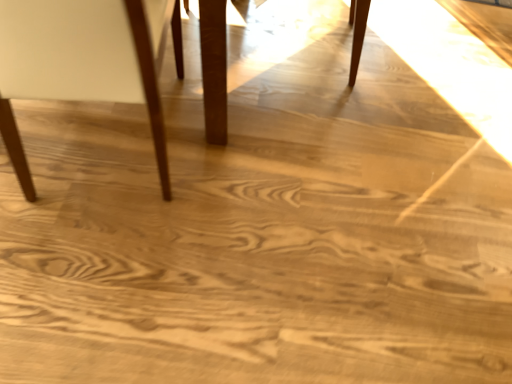
Where is `vacant region to the right of wooden chair leg at left`? This screenshot has width=512, height=384. vacant region to the right of wooden chair leg at left is located at coordinates (271, 191).